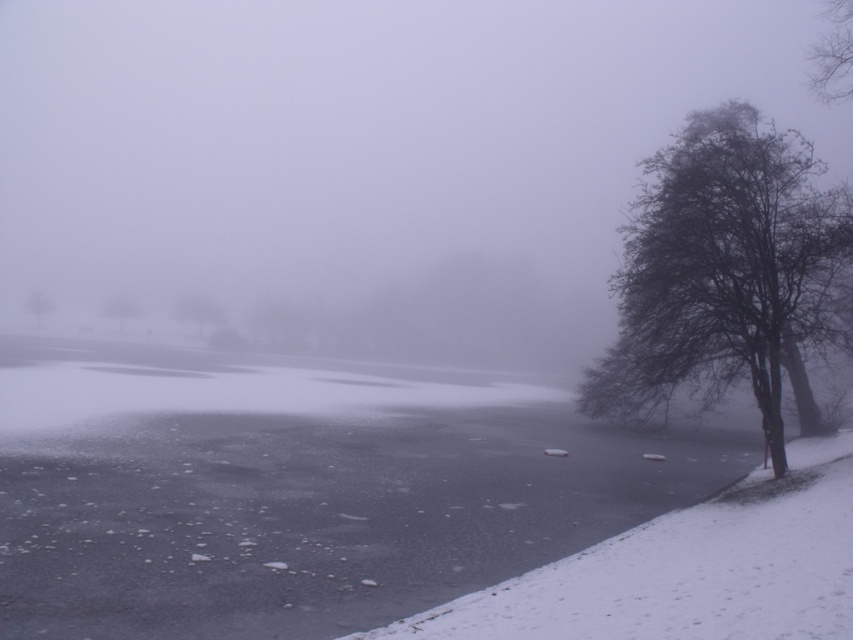
Question: Which point is farther to the camera?

Choices:
 (A) (123, 316)
 (B) (769, 275)
 (C) (206, 316)

Answer: (A)

Question: Where is dark gray bark tree at right located in relation to green matte tree at center in the image?

Choices:
 (A) left
 (B) right

Answer: (B)

Question: Which of the following is the farthest from the observer?

Choices:
 (A) bare branches at upper right
 (B) green matte tree at center

Answer: (B)

Question: Based on their relative distances, which object is nearer to the bare branches at left?

Choices:
 (A) bare branches at upper right
 (B) brown matte tree at center
 (C) green matte tree at center
 (D) smooth gray tree at center

Answer: (B)

Question: Can you confirm if dark gray bark tree at right is positioned to the left of brown matte tree at center?

Choices:
 (A) no
 (B) yes

Answer: (A)

Question: Is dark gray bark tree at right smaller than bare branches at upper right?

Choices:
 (A) yes
 (B) no

Answer: (B)